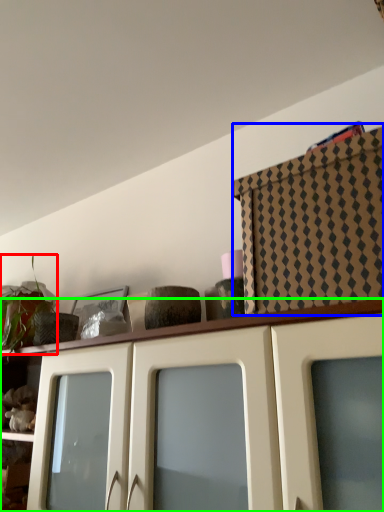
Question: Estimate the real-world distances between objects in this image. Which object is closer to plant (highlighted by a red box), cabinetry (highlighted by a blue box) or cabinetry (highlighted by a green box)?

Choices:
 (A) cabinetry
 (B) cabinetry

Answer: (B)